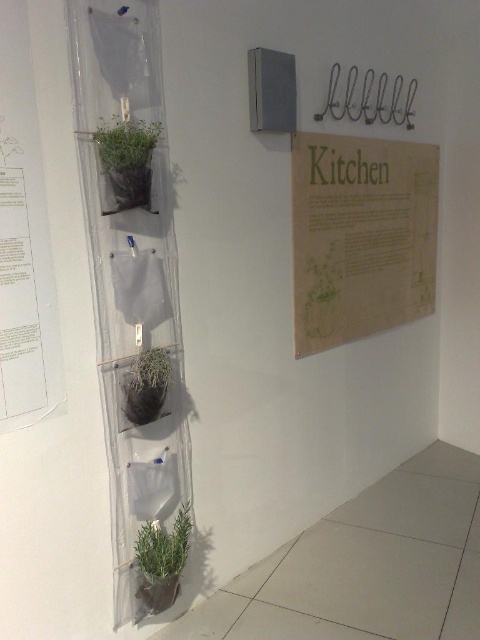
Can you confirm if burlap paper sign at upper right is taller than green fabric plant at upper center?

Indeed, burlap paper sign at upper right has a greater height compared to green fabric plant at upper center.

Can you confirm if burlap paper sign at upper right is bigger than green fabric plant at upper center?

Correct, burlap paper sign at upper right is larger in size than green fabric plant at upper center.

Identify the location of burlap paper sign at upper right. Image resolution: width=480 pixels, height=640 pixels. (360, 236).

Does point (132, 122) lie behind point (147, 365)?

No, it is not.

Is point (107, 168) in front of point (167, 364)?

Yes.

Find the location of `green fabric plant at upper center`. green fabric plant at upper center is located at coordinates (127, 161).

Which is above, green matte plant at lower center or green matte plant at center?

Positioned higher is green matte plant at center.

Does green matte plant at lower center have a greater width compared to green matte plant at center?

Yes, green matte plant at lower center is wider than green matte plant at center.

Locate an element on the screen. green matte plant at lower center is located at coordinates (164, 547).

At what (x,y) coordinates should I click in order to perform the action: click on green matte plant at lower center. Please return your answer as a coordinate pair (x, y). The width and height of the screenshot is (480, 640). Looking at the image, I should click on [164, 547].